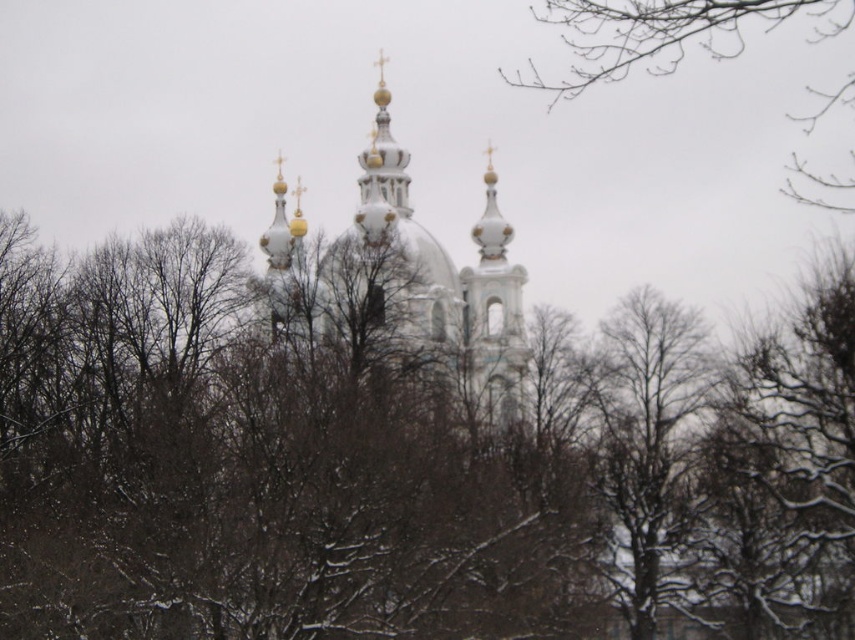
You are an architect visiting a winter landscape with a cathedral in the background. You notice the brown textured tree at center and the bare branches at upper right. Which of these two objects is larger in size?

The brown textured tree at center is bigger than the bare branches at upper right, so the brown textured tree at center is larger in size.

You are a photographer trying to capture the cathedral in the background. You notice the brown textured tree at center and the bare branches at upper right. Which object is closer to you, the photographer?

The brown textured tree at center is closer to you because it is in front of the bare branches at upper right.